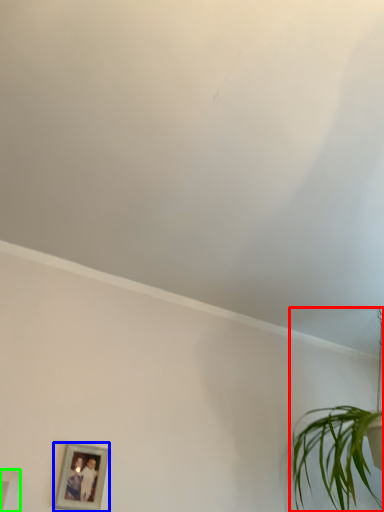
Question: Estimate the real-world distances between objects in this image. Which object is farther from houseplant (highlighted by a red box), picture frame (highlighted by a blue box) or picture frame (highlighted by a green box)?

Choices:
 (A) picture frame
 (B) picture frame

Answer: (B)